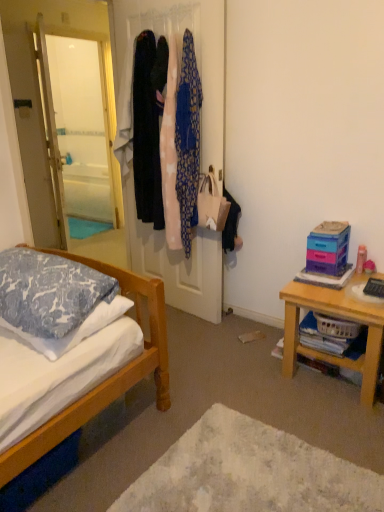
The height and width of the screenshot is (512, 384). I want to click on free space in front of silky fabric coats at center, so click(198, 342).